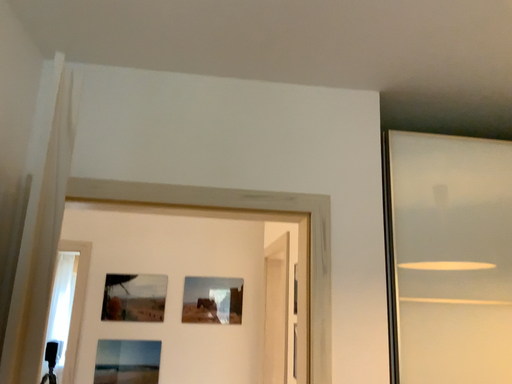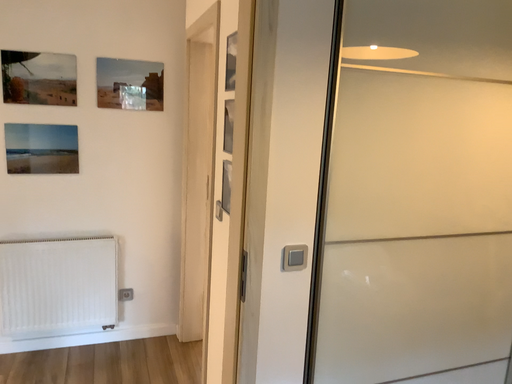
Question: Which way did the camera rotate in the video?

Choices:
 (A) rotated downward
 (B) rotated upward

Answer: (A)